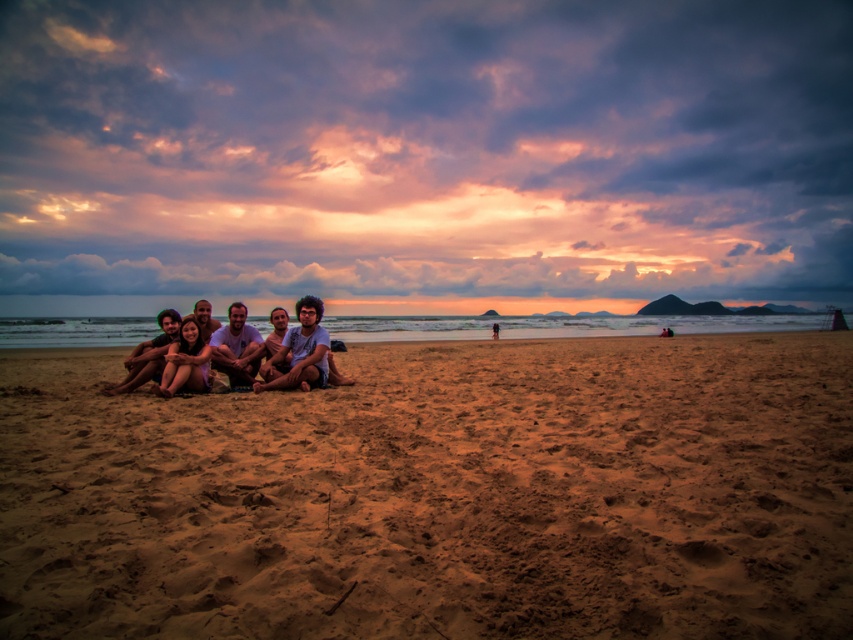
You are a photographer standing at the edge of the brown sandy beach at center and want to take a photo of the matte white shirt at center. Since the shirt is taller than the beach, will you need to adjust your camera angle upwards to capture it properly?

The matte white shirt at center is taller than the brown sandy beach at center, so you will need to adjust your camera angle upwards to capture it properly.